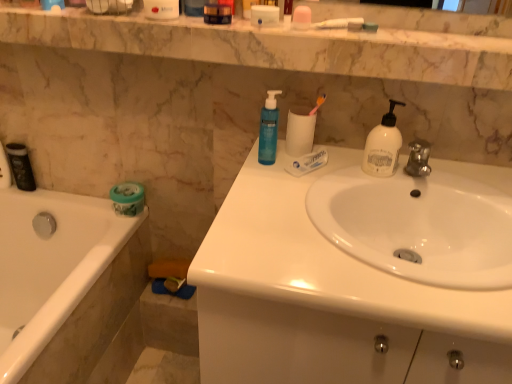
Identify the location of vacant area located to the right-hand side of white matte soap dispenser at upper right, the first soap dispenser viewed from the right. This screenshot has height=384, width=512. (456, 180).